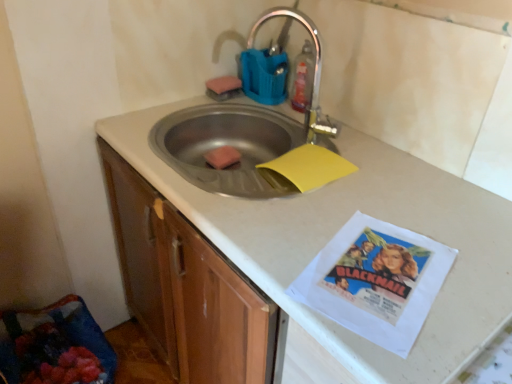
Question: Does translucent plastic bottle at upper center have a greater width compared to white matte countertop at center?

Choices:
 (A) yes
 (B) no

Answer: (B)

Question: Could you tell me if translucent plastic bottle at upper center is turned towards white matte countertop at center?

Choices:
 (A) yes
 (B) no

Answer: (B)

Question: Can we say translucent plastic bottle at upper center lies outside white matte countertop at center?

Choices:
 (A) yes
 (B) no

Answer: (A)

Question: Is translucent plastic bottle at upper center not near white matte countertop at center?

Choices:
 (A) yes
 (B) no

Answer: (B)

Question: Is translucent plastic bottle at upper center oriented away from white matte countertop at center?

Choices:
 (A) no
 (B) yes

Answer: (A)

Question: Considering the relative sizes of translucent plastic bottle at upper center and white matte countertop at center in the image provided, is translucent plastic bottle at upper center taller than white matte countertop at center?

Choices:
 (A) no
 (B) yes

Answer: (A)

Question: Does white matte countertop at center have a smaller size compared to yellow matte paper at sink?

Choices:
 (A) yes
 (B) no

Answer: (B)

Question: Could yellow matte paper at sink be considered to be inside white matte countertop at center?

Choices:
 (A) yes
 (B) no

Answer: (A)

Question: Is white matte countertop at center further to camera compared to yellow matte paper at sink?

Choices:
 (A) yes
 (B) no

Answer: (B)

Question: From a real-world perspective, is white matte countertop at center positioned under yellow matte paper at sink based on gravity?

Choices:
 (A) yes
 (B) no

Answer: (A)

Question: Can you confirm if white matte countertop at center is taller than yellow matte paper at sink?

Choices:
 (A) yes
 (B) no

Answer: (A)

Question: Does white matte countertop at center have a lesser width compared to yellow matte paper at sink?

Choices:
 (A) no
 (B) yes

Answer: (A)

Question: Is yellow matte paper at sink behind pink sponge at sink, the first food ordered from the bottom?

Choices:
 (A) no
 (B) yes

Answer: (A)